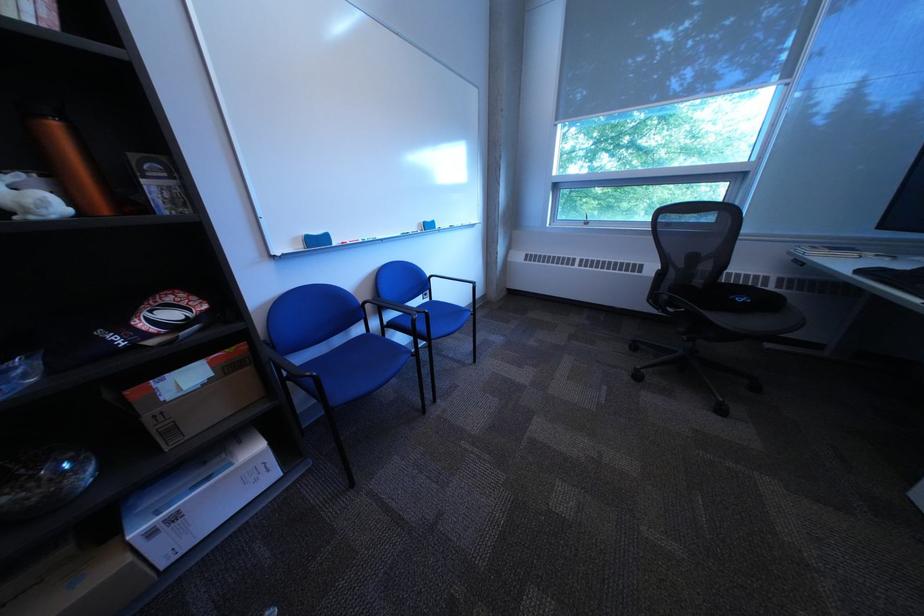
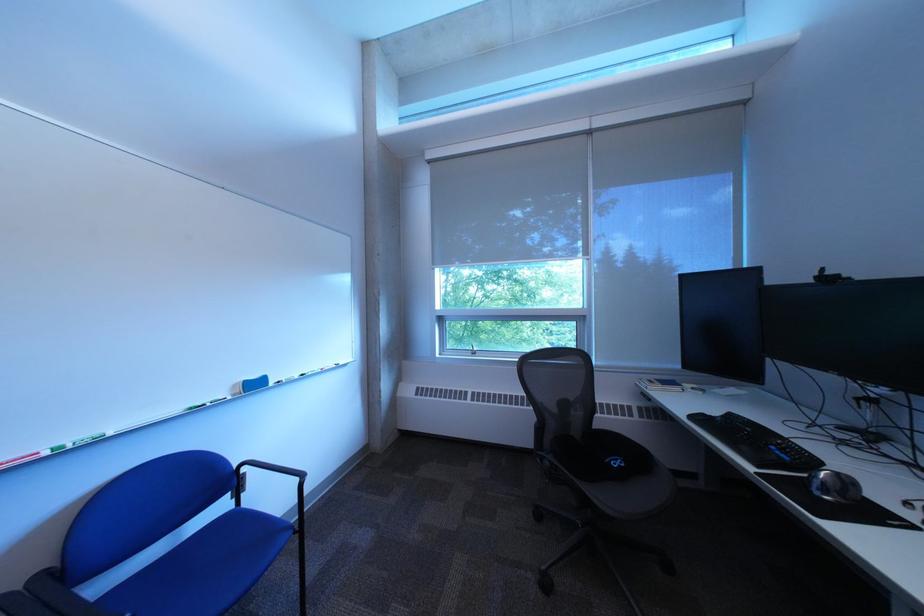
Where in the second image is the point corresponding to (601,222) from the first image?

(488, 351)